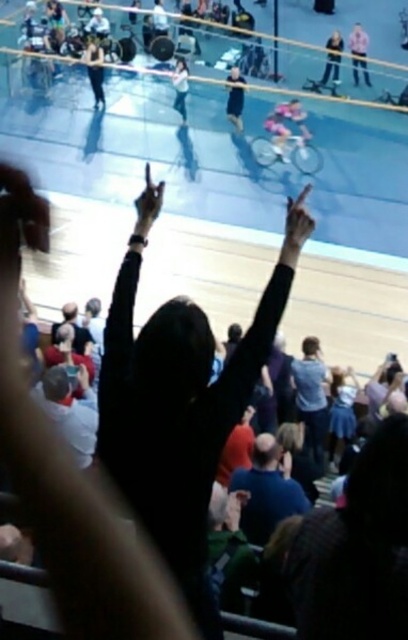
You are a photographer at the cycling event. You want to capture a photo of both the light blue fabric at center and the matte black jacket at upper right in the same frame. Based on their positions, which object will appear closer to the bottom of the photo?

The light blue fabric at center will appear closer to the bottom of the photo because it is shorter than the matte black jacket at upper right.

You are a photographer at the cycling event and want to capture a photo of both the light blue fabric at center and the light blue jersey at upper center. Which object should you focus on first to ensure both are in sharp focus?

You should focus on the light blue fabric at center first since it is closer to the viewer than the light blue jersey at upper center, allowing the jersey to be in focus as well due to depth of field.

You are a photographer standing at the edge of the track. You want to take a photo of the blue denim shirt at center. Where should you aim your camera to capture it?

The blue denim shirt at center is located at point 0.623 on the x axis and 0.765 on the y axis, so you should aim your camera at those coordinates to capture it.